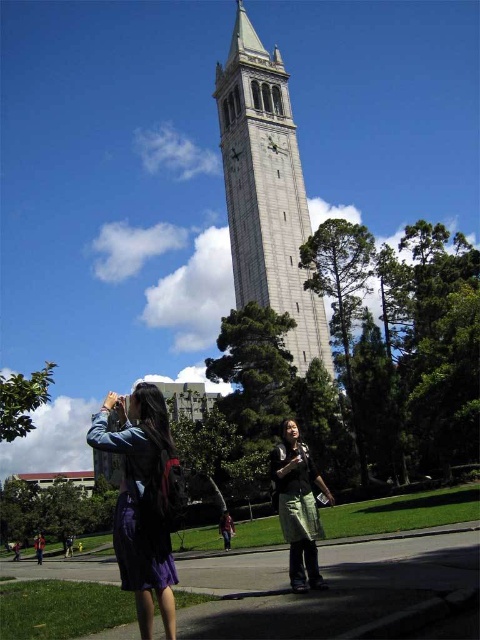
Does point (153, 584) come farther from viewer compared to point (294, 467)?

No, it is not.

Does matte purple dress at lower left have a smaller size compared to green fabric skirt at lower center?

No, matte purple dress at lower left is not smaller than green fabric skirt at lower center.

Is point (164, 500) farther from viewer compared to point (314, 528)?

That is False.

The width and height of the screenshot is (480, 640). In order to click on matte purple dress at lower left in this screenshot , I will do `click(142, 499)`.

Can you confirm if gray stone clock tower at center is taller than green fabric skirt at lower center?

Correct, gray stone clock tower at center is much taller as green fabric skirt at lower center.

Who is more forward, (216, 380) or (284, 525)?

Positioned in front is point (284, 525).

Is point (279, 184) less distant than point (309, 452)?

No, (279, 184) is further to viewer.

Where is `gray stone clock tower at center`? The image size is (480, 640). gray stone clock tower at center is located at coordinates (265, 189).

Which is above, gray stone clock tower at center or matte purple dress at lower left?

gray stone clock tower at center is above.

Locate an element on the screen. gray stone clock tower at center is located at coordinates (265, 189).

Who is more distant from viewer, (286, 308) or (130, 490)?

Point (286, 308)

You are a GUI agent. You are given a task and a screenshot of the screen. Output one action in this format:
    pyautogui.click(x=<x>, y=<y>)
    Task: Click on the gray stone clock tower at center
    
    Given the screenshot: What is the action you would take?
    pyautogui.click(x=265, y=189)